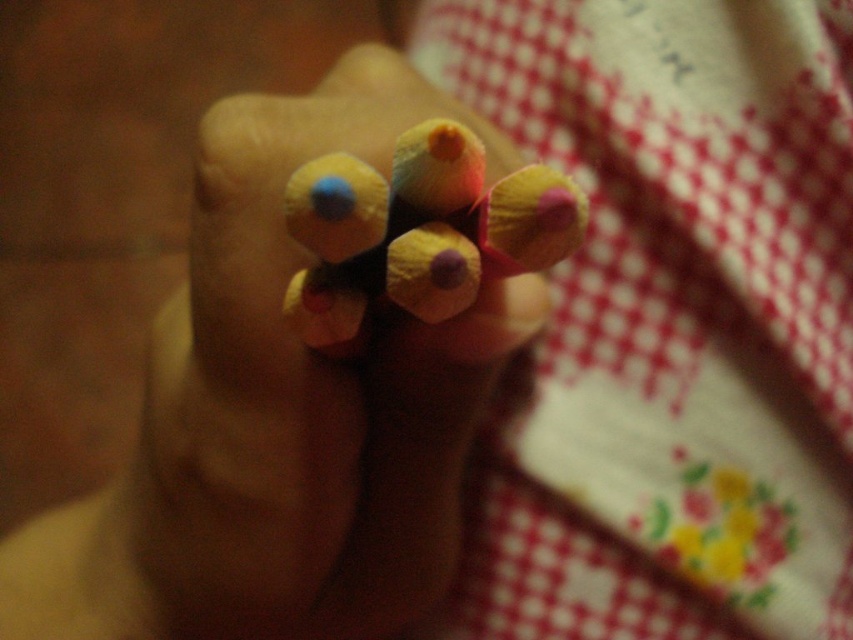
You are an artist preparing your workspace. You have a white dotted fabric at upper center and a wooden pencil case at center. Where should you place your new sketchbook to ensure it doesn

The white dotted fabric at upper center is located above the wooden pencil case at center. To place your new sketchbook, you should put it below the white dotted fabric at upper center and above the wooden pencil case at center to ensure it is in the clear space between them.

You are an artist preparing your materials. You have a wooden pencil case at center and matte wooden pencils at center. Where should you place your hand to reach both items easily?

You should place your hand above the wooden pencil case at center because it is located below the matte wooden pencils at center, allowing easy access to both items.

You are an artist trying to place a 10 inch ruler between the white dotted fabric at upper center and the matte wooden pencils at center. Can you fit the ruler horizontally between them without overlapping either object?

The distance between the white dotted fabric at upper center and the matte wooden pencils at center is 9.03 inches. Since the ruler is 10 inches long, it cannot fit horizontally between them without overlapping either object.